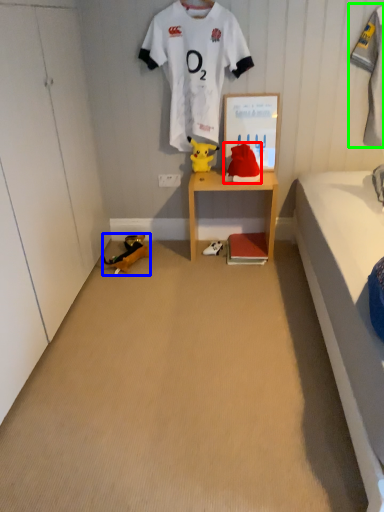
Question: Estimate the real-world distances between objects in this image. Which object is farther from toy (highlighted by a red box), toy (highlighted by a blue box) or clothing (highlighted by a green box)?

Choices:
 (A) toy
 (B) clothing

Answer: (A)